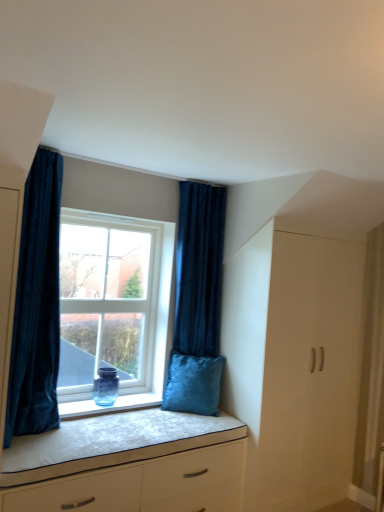
Locate an element on the screen. blank space situated above velvet dark blue curtain at left, which ranks as the 1th curtain in front-to-back order (from a real-world perspective) is located at coordinates (61, 142).